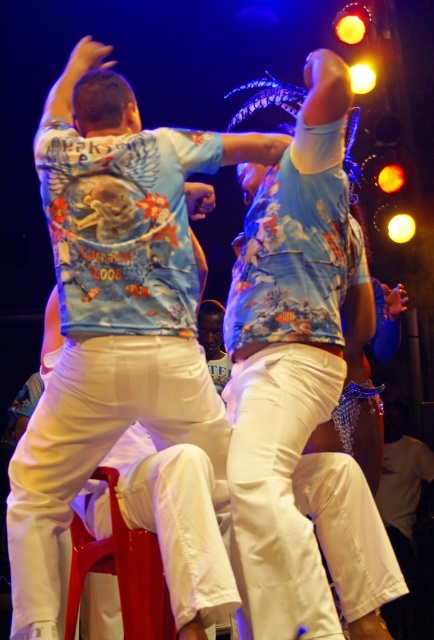
Question: Which object is farther from the camera taking this photo?

Choices:
 (A) printed cotton shirt at upper center
 (B) blue printed shirt at upper center

Answer: (B)

Question: Which point is farther to the camera?

Choices:
 (A) (305, 288)
 (B) (33, 529)

Answer: (A)

Question: Which object is farther from the camera taking this photo?

Choices:
 (A) blue printed shirt at upper center
 (B) printed cotton shirt at upper center

Answer: (A)

Question: From the image, what is the correct spatial relationship of blue printed shirt at upper center in relation to printed cotton shirt at upper center?

Choices:
 (A) above
 (B) below

Answer: (A)

Question: Does blue printed shirt at upper center appear under printed cotton shirt at upper center?

Choices:
 (A) no
 (B) yes

Answer: (A)

Question: Can you confirm if blue printed shirt at upper center is positioned to the left of printed cotton shirt at upper center?

Choices:
 (A) yes
 (B) no

Answer: (A)